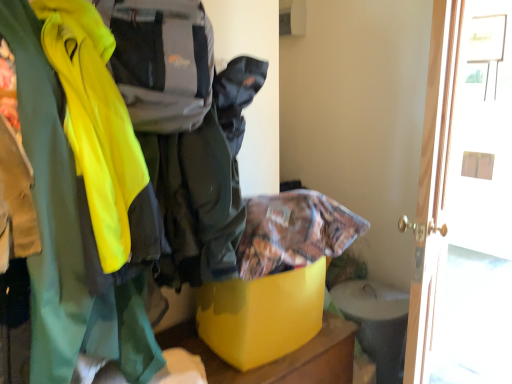
Question: Can you confirm if yellow plastic storage box at center is smaller than printed fabric bag at center?

Choices:
 (A) no
 (B) yes

Answer: (A)

Question: Is yellow plastic storage box at center taller than printed fabric bag at center?

Choices:
 (A) no
 (B) yes

Answer: (B)

Question: Does yellow plastic storage box at center have a greater width compared to printed fabric bag at center?

Choices:
 (A) yes
 (B) no

Answer: (A)

Question: Is yellow plastic storage box at center with printed fabric bag at center?

Choices:
 (A) yes
 (B) no

Answer: (B)

Question: Can you confirm if yellow plastic storage box at center is shorter than printed fabric bag at center?

Choices:
 (A) yes
 (B) no

Answer: (B)

Question: Considering the positions of yellow plastic storage box at center and printed fabric bag at center in the image, is yellow plastic storage box at center wider or thinner than printed fabric bag at center?

Choices:
 (A) wide
 (B) thin

Answer: (A)

Question: In the image, is yellow plastic storage box at center on the left side or the right side of printed fabric bag at center?

Choices:
 (A) right
 (B) left

Answer: (B)

Question: In terms of height, does yellow plastic storage box at center look taller or shorter compared to printed fabric bag at center?

Choices:
 (A) short
 (B) tall

Answer: (B)

Question: From the image's perspective, is yellow plastic storage box at center located above or below printed fabric bag at center?

Choices:
 (A) above
 (B) below

Answer: (B)

Question: From the image's perspective, relative to white glossy door at right, is printed fabric bag at center above or below?

Choices:
 (A) below
 (B) above

Answer: (A)

Question: Is printed fabric bag at center spatially inside white glossy door at right, or outside of it?

Choices:
 (A) outside
 (B) inside

Answer: (A)

Question: Is printed fabric bag at center wider or thinner than white glossy door at right?

Choices:
 (A) thin
 (B) wide

Answer: (B)

Question: Is printed fabric bag at center to the left or to the right of white glossy door at right in the image?

Choices:
 (A) right
 (B) left

Answer: (B)

Question: Is point (308, 278) closer or farther from the camera than point (440, 13)?

Choices:
 (A) farther
 (B) closer

Answer: (A)

Question: Visually, is yellow plastic storage box at center positioned to the left or to the right of white glossy door at right?

Choices:
 (A) right
 (B) left

Answer: (B)